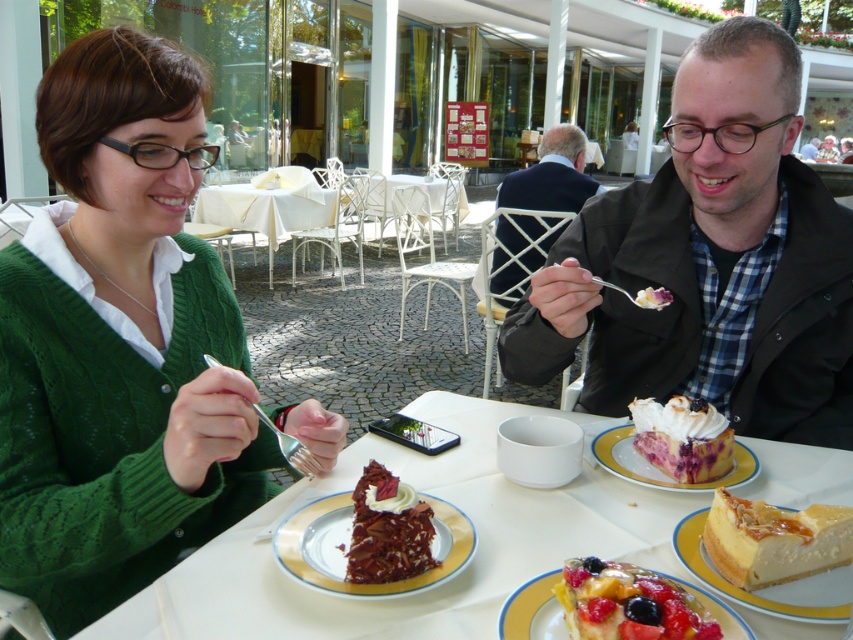
Is dark blue textured jacket at center shorter than matte black jacket at upper right?

Incorrect, dark blue textured jacket at center's height does not fall short of matte black jacket at upper right's.

Can you confirm if dark blue textured jacket at center is positioned to the left of matte black jacket at upper right?

Correct, you'll find dark blue textured jacket at center to the left of matte black jacket at upper right.

Does point (549, 179) lie in front of point (802, 145)?

Yes, point (549, 179) is closer to viewer.

The width and height of the screenshot is (853, 640). In order to click on dark blue textured jacket at center in this screenshot , I will do point(550,176).

In the scene shown: Between matte white plate at center and matte black jacket at upper right, which one is positioned higher?

Positioned higher is matte black jacket at upper right.

Who is more forward, (508, 560) or (811, 145)?

Positioned in front is point (508, 560).

You are a GUI agent. You are given a task and a screenshot of the screen. Output one action in this format:
    pyautogui.click(x=<x>, y=<y>)
    Task: Click on the matte white plate at center
    
    Given the screenshot: What is the action you would take?
    pyautogui.click(x=430, y=589)

At what (x,y) coordinates should I click in order to perform the action: click on matte white plate at center. Please return your answer as a coordinate pair (x, y). This screenshot has width=853, height=640. Looking at the image, I should click on (430, 589).

Is white plastic table at center above light brown wooden chair at upper center?

No.

Which of these two, white plastic table at center or light brown wooden chair at upper center, stands shorter?

Standing shorter between the two is light brown wooden chair at upper center.

The width and height of the screenshot is (853, 640). In order to click on white plastic table at center in this screenshot , I will do `click(410, 186)`.